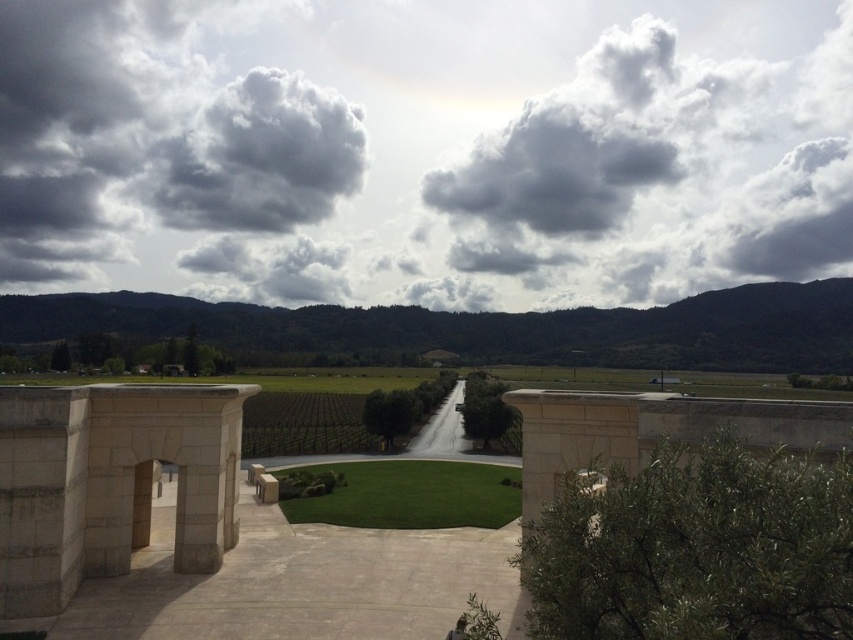
Question: Is dark gray fluffy cloud at upper left positioned in front of green artificial turf at center?

Choices:
 (A) yes
 (B) no

Answer: (B)

Question: Which is nearer to the green artificial turf at center?

Choices:
 (A) cloudy sky at upper center
 (B) dark gray fluffy cloud at upper left

Answer: (B)

Question: Based on their relative distances, which object is farther from the dark gray fluffy cloud at upper left?

Choices:
 (A) cloudy sky at upper center
 (B) green artificial turf at center

Answer: (B)

Question: Does cloudy sky at upper center have a smaller size compared to green artificial turf at center?

Choices:
 (A) yes
 (B) no

Answer: (B)

Question: Is cloudy sky at upper center smaller than green artificial turf at center?

Choices:
 (A) yes
 (B) no

Answer: (B)

Question: Which object is positioned farthest from the cloudy sky at upper center?

Choices:
 (A) dark gray fluffy cloud at upper left
 (B) green artificial turf at center

Answer: (B)